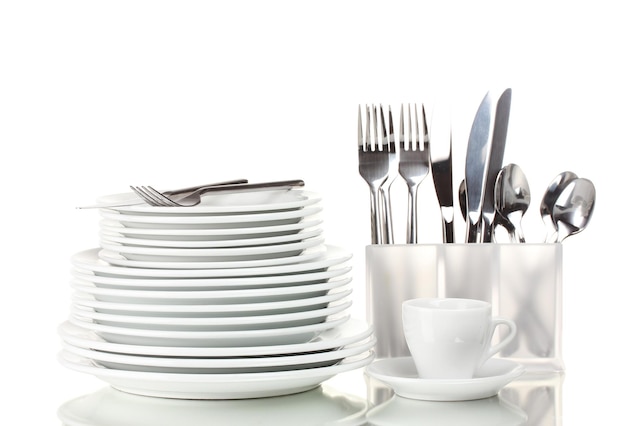
What are the coordinates of `knives` in the screenshot? It's located at (100, 204), (444, 180), (478, 143), (495, 135).